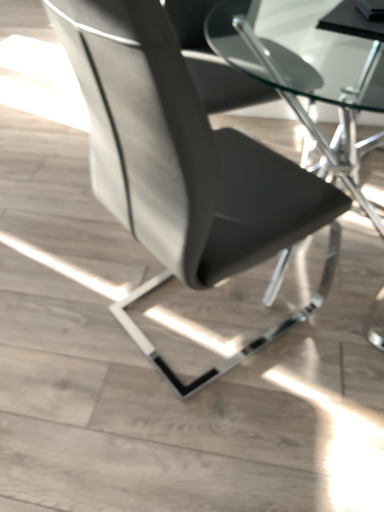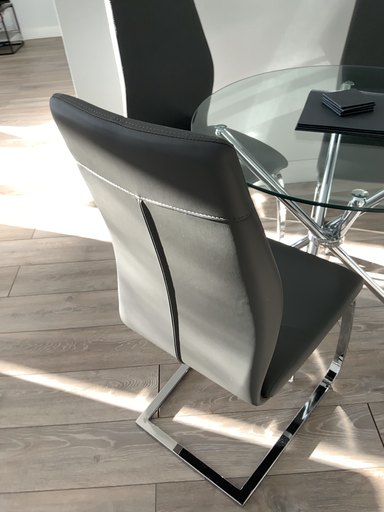
Question: How did the camera likely rotate when shooting the video?

Choices:
 (A) rotated upward
 (B) rotated downward

Answer: (A)